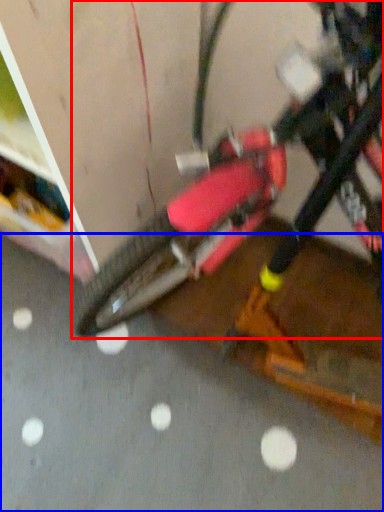
Question: Which of the following is the farthest to the observer, bicycle (highlighted by a red box) or concrete (highlighted by a blue box)?

Choices:
 (A) bicycle
 (B) concrete

Answer: (B)